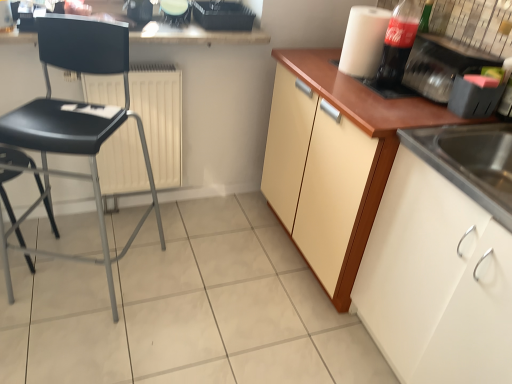
Identify the location of translucent plastic bottle at upper right. (398, 43).

This screenshot has height=384, width=512. Find the location of `stainless steel sink at lower right`. stainless steel sink at lower right is located at coordinates (470, 161).

Image resolution: width=512 pixels, height=384 pixels. Identify the location of matte wood cabinet at right, the 1th cabinetry from the back. (358, 165).

Can you see black plastic chair at left, the first chair viewed from the left, touching white matte cabinet at lower right, which appears as the first cabinetry when viewed from the front?

There is a gap between black plastic chair at left, the first chair viewed from the left, and white matte cabinet at lower right, which appears as the first cabinetry when viewed from the front.

From the white matte cabinet at lower right, which appears as the first cabinetry when viewed from the front, count the 2nd chair to the left and point to it. Please provide its 2D coordinates.

[(15, 158)]

Considering the sizes of objects black plastic chair at left, the first chair viewed from the left, and white matte cabinet at lower right, which appears as the first cabinetry when viewed from the front, in the image provided, who is taller, black plastic chair at left, the first chair viewed from the left, or white matte cabinet at lower right, which appears as the first cabinetry when viewed from the front,?

With more height is white matte cabinet at lower right, which appears as the first cabinetry when viewed from the front.

Is black plastic chair at left, the first chair viewed from the left, facing towards white matte cabinet at lower right, which appears as the first cabinetry when viewed from the front?

No, black plastic chair at left, the first chair viewed from the left, is not facing towards white matte cabinet at lower right, which appears as the first cabinetry when viewed from the front.

Do you think white glossy blender at upper center, placed as the 1th appliance when sorted from left to right, is within black plastic chair at left, placed as the first chair when sorted from right to left, or outside of it?

white glossy blender at upper center, placed as the 1th appliance when sorted from left to right, is not enclosed by black plastic chair at left, placed as the first chair when sorted from right to left.

Is point (174, 18) positioned before point (121, 29)?

No, it is behind (121, 29).

Who is taller, white glossy blender at upper center, which appears as the 3th appliance when viewed from the right, or black plastic chair at left, acting as the 2th chair starting from the left?

black plastic chair at left, acting as the 2th chair starting from the left, is taller.

From a real-world perspective, is black plastic tray at upper center, which is counted as the 2th appliance, starting from the left, physically located above or below translucent plastic bottle at upper right?

black plastic tray at upper center, which is counted as the 2th appliance, starting from the left, is below translucent plastic bottle at upper right.

Where is `bottle below the black plastic tray at upper center, which is counted as the 2th appliance, starting from the left (from the image's perspective)`? Image resolution: width=512 pixels, height=384 pixels. bottle below the black plastic tray at upper center, which is counted as the 2th appliance, starting from the left (from the image's perspective) is located at coordinates (398, 43).

Can you confirm if black plastic tray at upper center, which is counted as the 2th appliance, starting from the left, is smaller than translucent plastic bottle at upper right?

Actually, black plastic tray at upper center, which is counted as the 2th appliance, starting from the left, might be larger than translucent plastic bottle at upper right.

Could you tell me if black plastic tray at upper center, placed as the second appliance when sorted from right to left, is facing translucent plastic bottle at upper right?

No, black plastic tray at upper center, placed as the second appliance when sorted from right to left, is not oriented towards translucent plastic bottle at upper right.

What's the angular difference between metallic silver toaster at upper right, the 3th appliance positioned from the left, and matte wood cabinet at right, arranged as the second cabinetry when viewed from the front,'s facing directions?

0.000105 degrees separate the facing orientations of metallic silver toaster at upper right, the 3th appliance positioned from the left, and matte wood cabinet at right, arranged as the second cabinetry when viewed from the front.

Is metallic silver toaster at upper right, the 3th appliance positioned from the left, beside matte wood cabinet at right, arranged as the second cabinetry when viewed from the front?

metallic silver toaster at upper right, the 3th appliance positioned from the left, and matte wood cabinet at right, arranged as the second cabinetry when viewed from the front, are clearly separated.

Locate an element on the screen. appliance that is the 2nd one above the matte wood cabinet at right, the 1th cabinetry from the back (from a real-world perspective) is located at coordinates (442, 65).

From the image's perspective, between metallic silver toaster at upper right, which is the 1th appliance from right to left, and matte wood cabinet at right, the 1th cabinetry from the back, who is located below?

From the image's view, matte wood cabinet at right, the 1th cabinetry from the back, is below.

Is matte wood cabinet at right, arranged as the second cabinetry when viewed from the front, surrounding translucent plastic bottle at upper right?

No, matte wood cabinet at right, arranged as the second cabinetry when viewed from the front, does not contain translucent plastic bottle at upper right.

Where is `cabinetry that is the 1st one below the translucent plastic bottle at upper right (from a real-world perspective)`? The height and width of the screenshot is (384, 512). cabinetry that is the 1st one below the translucent plastic bottle at upper right (from a real-world perspective) is located at coordinates [358, 165].

Can you tell me how much matte wood cabinet at right, arranged as the second cabinetry when viewed from the front, and translucent plastic bottle at upper right differ in facing direction?

They differ by 6.13e-05 degrees in their facing directions.

Which object is positioned more to the right, matte wood cabinet at right, the 1th cabinetry from the back, or translucent plastic bottle at upper right?

translucent plastic bottle at upper right.

Where is `appliance in front of the white glossy blender at upper center, which appears as the 3th appliance when viewed from the right`? This screenshot has height=384, width=512. appliance in front of the white glossy blender at upper center, which appears as the 3th appliance when viewed from the right is located at coordinates (442, 65).

Considering the positions of objects white glossy blender at upper center, which appears as the 3th appliance when viewed from the right, and metallic silver toaster at upper right, the 3th appliance positioned from the left, in the image provided, who is more to the right, white glossy blender at upper center, which appears as the 3th appliance when viewed from the right, or metallic silver toaster at upper right, the 3th appliance positioned from the left,?

From the viewer's perspective, metallic silver toaster at upper right, the 3th appliance positioned from the left, appears more on the right side.

From a real-world perspective, who is located lower, white glossy blender at upper center, which appears as the 3th appliance when viewed from the right, or metallic silver toaster at upper right, the 3th appliance positioned from the left?

In real-world perspective, metallic silver toaster at upper right, the 3th appliance positioned from the left, is lower.

Are white glossy blender at upper center, placed as the 1th appliance when sorted from left to right, and metallic silver toaster at upper right, the 3th appliance positioned from the left, far apart?

Absolutely, white glossy blender at upper center, placed as the 1th appliance when sorted from left to right, is distant from metallic silver toaster at upper right, the 3th appliance positioned from the left.

In the image, is smooth white countertop at upper center positioned in front of or behind metallic silver toaster at upper right, which is the 1th appliance from right to left?

In the image, smooth white countertop at upper center appears behind metallic silver toaster at upper right, which is the 1th appliance from right to left.

Is point (205, 31) in front of point (447, 64)?

No, (205, 31) is further to viewer.

You are a GUI agent. You are given a task and a screenshot of the screen. Output one action in this format:
    pyautogui.click(x=<x>, y=<y>)
    Task: Click on the countertop that is behind the metallic silver toaster at upper right, which is the 1th appliance from right to left
    This screenshot has width=512, height=384.
    Given the screenshot: What is the action you would take?
    pyautogui.click(x=196, y=35)

From a real-world perspective, which cabinetry is the 1st one above the black plastic chair at left, the first chair viewed from the left? Please provide its 2D coordinates.

[(436, 281)]

Identify the location of the 1st chair positioned below the white glossy blender at upper center, which appears as the 3th appliance when viewed from the right (from the image's perspective). This screenshot has width=512, height=384. (75, 121).

Based on their spatial positions, is smooth white countertop at upper center or black plastic chair at left, the first chair viewed from the left, further from black plastic chair at left, placed as the first chair when sorted from right to left?

smooth white countertop at upper center is positioned further to the anchor black plastic chair at left, placed as the first chair when sorted from right to left.

Based on the photo, considering their positions, is stainless steel sink at lower right positioned further to white matte cabinet at lower right, arranged as the 2th cabinetry when viewed from the back, than white matte radiator at center?

Based on the image, white matte radiator at center appears to be further to white matte cabinet at lower right, arranged as the 2th cabinetry when viewed from the back.

Which object lies further to the anchor point smooth white countertop at upper center, white matte paper towel at upper right or black plastic chair at left, placed as the first chair when sorted from right to left?

black plastic chair at left, placed as the first chair when sorted from right to left, is further to smooth white countertop at upper center.

When comparing their distances from white glossy blender at upper center, placed as the 1th appliance when sorted from left to right, does white matte radiator at center or black plastic chair at left, placed as the first chair when sorted from right to left, seem closer?

The object closer to white glossy blender at upper center, placed as the 1th appliance when sorted from left to right, is white matte radiator at center.

From the image, which object appears to be farther from matte wood cabinet at right, the 1th cabinetry from the back, translucent plastic bottle at upper right or black plastic chair at left, the first chair viewed from the left?

Among the two, black plastic chair at left, the first chair viewed from the left, is located further to matte wood cabinet at right, the 1th cabinetry from the back.

Looking at the image, which one is located further to white matte paper towel at upper right, metallic silver toaster at upper right, the 3th appliance positioned from the left, or white matte cabinet at lower right, arranged as the 2th cabinetry when viewed from the back?

white matte cabinet at lower right, arranged as the 2th cabinetry when viewed from the back, is further to white matte paper towel at upper right.

Which object lies further to the anchor point stainless steel sink at lower right, white glossy blender at upper center, placed as the 1th appliance when sorted from left to right, or smooth white countertop at upper center?

Based on the image, white glossy blender at upper center, placed as the 1th appliance when sorted from left to right, appears to be further to stainless steel sink at lower right.

Estimate the real-world distances between objects in this image. Which object is closer to metallic silver toaster at upper right, which is the 1th appliance from right to left, black plastic chair at left, acting as the 2th chair starting from the left, or smooth white countertop at upper center?

Among the two, smooth white countertop at upper center is located nearer to metallic silver toaster at upper right, which is the 1th appliance from right to left.

Find the location of `radiator between black plastic chair at left, placed as the first chair when sorted from right to left, and white matte cabinet at lower right, which appears as the first cabinetry when viewed from the front, from left to right`. radiator between black plastic chair at left, placed as the first chair when sorted from right to left, and white matte cabinet at lower right, which appears as the first cabinetry when viewed from the front, from left to right is located at coordinates (160, 118).

This screenshot has width=512, height=384. I want to click on paper towel located between white matte radiator at center and metallic silver toaster at upper right, which is the 1th appliance from right to left, in the left-right direction, so click(x=364, y=41).

Locate an element on the screen. countertop located between black plastic chair at left, acting as the 2th chair starting from the left, and metallic silver toaster at upper right, which is the 1th appliance from right to left, in the left-right direction is located at coordinates (196, 35).

At what (x,y) coordinates should I click in order to perform the action: click on bottle between smooth white countertop at upper center and metallic silver toaster at upper right, which is the 1th appliance from right to left, in the horizontal direction. Please return your answer as a coordinate pair (x, y). This screenshot has height=384, width=512. Looking at the image, I should click on (398, 43).